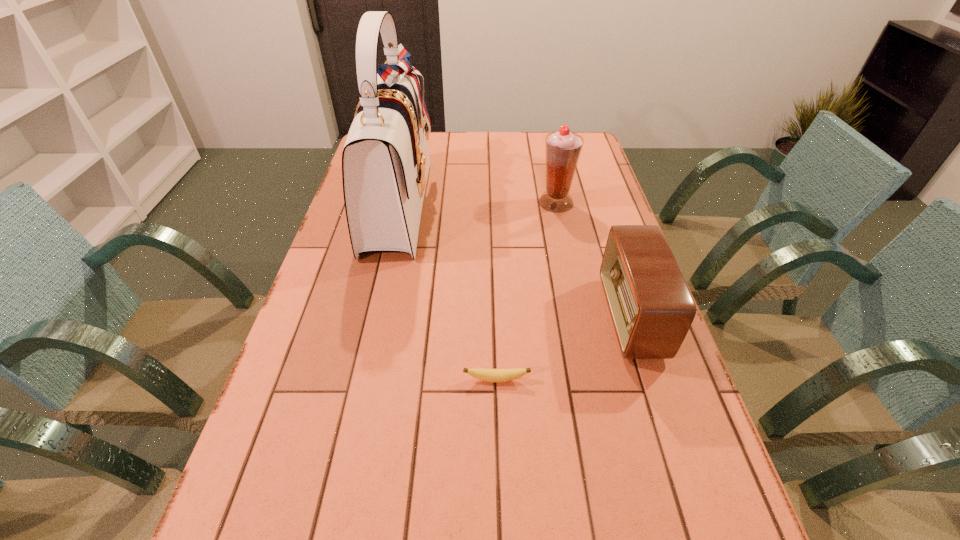
Identify the location of free spot between the nearest object and the rightmost object. (564, 349).

This screenshot has height=540, width=960. I want to click on free space between the leftmost object and the banana, so click(447, 292).

This screenshot has width=960, height=540. Find the location of `empty space between the tallest object and the second object from right to left`. empty space between the tallest object and the second object from right to left is located at coordinates (477, 203).

Where is `object that is the closest to the third shortest object`? This screenshot has height=540, width=960. object that is the closest to the third shortest object is located at coordinates (652, 309).

Choose which object is the second nearest neighbor to the second shortest object. Please provide its 2D coordinates. Your answer should be formatted as a tuple, i.e. [(x, y)], where the tuple contains the x and y coordinates of a point satisfying the conditions above.

[(563, 148)]

Locate an element on the screen. Image resolution: width=960 pixels, height=540 pixels. vacant region that satisfies the following two spatial constraints: 1. on the front-facing side of the tallest object; 2. on the back side of the banana is located at coordinates (357, 380).

Image resolution: width=960 pixels, height=540 pixels. I want to click on free space that satisfies the following two spatial constraints: 1. on the front-facing side of the third tallest object; 2. on the front side of the second object from left to right, so click(x=651, y=380).